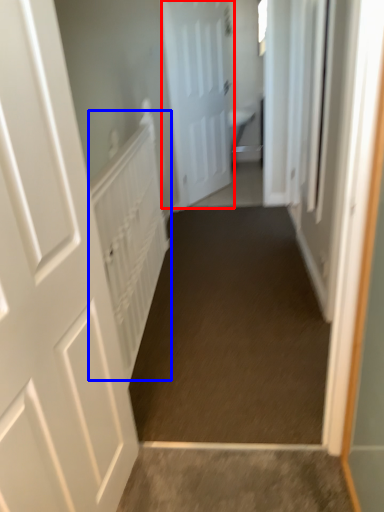
Question: Among these objects, which one is farthest to the camera, door (highlighted by a red box) or radiator (highlighted by a blue box)?

Choices:
 (A) door
 (B) radiator

Answer: (A)